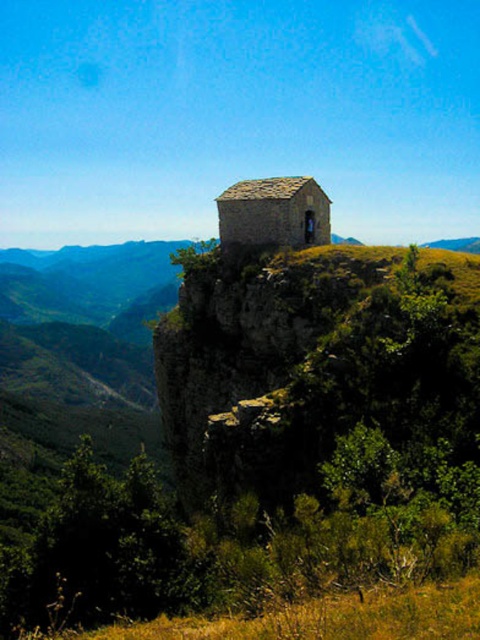
Who is higher up, brown rough rock at upper center or stone textured hut at center?

stone textured hut at center is above.

Does brown rough rock at upper center appear under stone textured hut at center?

Correct, brown rough rock at upper center is located below stone textured hut at center.

Between point (205, 436) and point (218, 196), which one is positioned behind?

The point (218, 196) is behind.

This screenshot has height=640, width=480. Find the location of `brown rough rock at upper center`. brown rough rock at upper center is located at coordinates (312, 362).